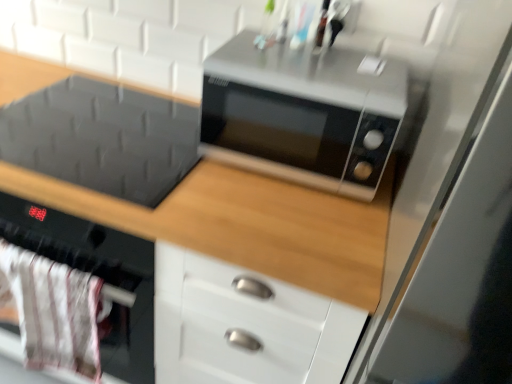
Find the location of a particular element. This screenshot has height=384, width=512. free point to the left of satin silver microwave at center is located at coordinates (151, 143).